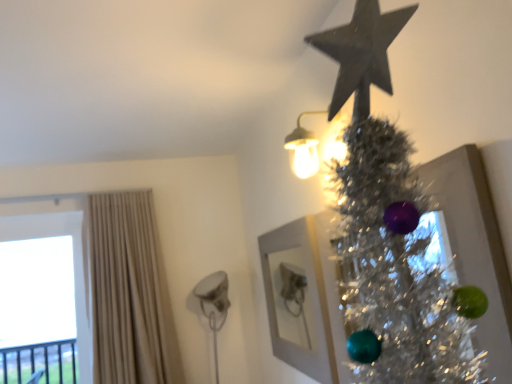
Where is `matte white sconce at upper right`? This screenshot has width=512, height=384. matte white sconce at upper right is located at coordinates (304, 148).

What do you see at coordinates (74, 265) in the screenshot? The width and height of the screenshot is (512, 384). I see `transparent glass window at left` at bounding box center [74, 265].

The height and width of the screenshot is (384, 512). I want to click on white matte picture frame at upper center, so click(x=304, y=299).

Can you confirm if white matte picture frame at upper center is positioned to the left of beige fabric curtain at left?

No.

Can you tell me how much white matte picture frame at upper center and beige fabric curtain at left differ in facing direction?

white matte picture frame at upper center and beige fabric curtain at left are facing 89.1 degrees away from each other.

From the picture: From the image's perspective, which is below, white matte picture frame at upper center or beige fabric curtain at left?

beige fabric curtain at left.

Between white matte picture frame at upper center and shiny silver tinsel at upper right, which one is positioned in front?

shiny silver tinsel at upper right.

Is point (320, 378) closer to viewer compared to point (429, 310)?

No, (320, 378) is behind (429, 310).

From the image's perspective, who appears lower, white matte picture frame at upper center or shiny silver tinsel at upper right?

From the image's view, white matte picture frame at upper center is below.

Considering the sizes of objects white matte picture frame at upper center and shiny silver tinsel at upper right in the image provided, who is thinner, white matte picture frame at upper center or shiny silver tinsel at upper right?

Thinner between the two is white matte picture frame at upper center.

Which of these two, shiny silver tinsel at upper right or beige fabric curtain at left, stands shorter?

With less height is shiny silver tinsel at upper right.

Which is in front, point (417, 218) or point (140, 286)?

The point (417, 218) is closer.

From a real-world perspective, which object rests below the other?

shiny silver tinsel at upper right is physically lower.

Identify the location of curtain below the matte white sconce at upper right (from the image's perspective). (130, 293).

In the image, is beige fabric curtain at left on the left side or the right side of matte white sconce at upper right?

In the image, beige fabric curtain at left appears on the left side of matte white sconce at upper right.

Does point (108, 362) come farther from viewer compared to point (301, 177)?

That is True.

From the picture: From the image's perspective, is beige fabric curtain at left positioned above or below matte white sconce at upper right?

From the image's perspective, beige fabric curtain at left appears below matte white sconce at upper right.

Between matte white sconce at upper right and beige fabric curtain at left, which one has more height?

With more height is beige fabric curtain at left.

Is matte white sconce at upper right not close to beige fabric curtain at left?

Yes.

Can we say matte white sconce at upper right lies outside beige fabric curtain at left?

Yes, matte white sconce at upper right is located beyond the bounds of beige fabric curtain at left.

From the picture: Measure the distance between matte white sconce at upper right and beige fabric curtain at left.

matte white sconce at upper right and beige fabric curtain at left are 5.63 feet apart from each other.

Could you tell me if beige fabric curtain at left is turned towards shiny silver tinsel at upper right?

No, beige fabric curtain at left does not turn towards shiny silver tinsel at upper right.

Looking at this image, considering the sizes of beige fabric curtain at left and shiny silver tinsel at upper right in the image, is beige fabric curtain at left wider or thinner than shiny silver tinsel at upper right?

In the image, beige fabric curtain at left appears to be wider than shiny silver tinsel at upper right.

Who is bigger, beige fabric curtain at left or shiny silver tinsel at upper right?

With larger size is beige fabric curtain at left.

From the image's perspective, between beige fabric curtain at left and shiny silver tinsel at upper right, which one is located above?

shiny silver tinsel at upper right.

Is transparent glass window at left taller than shiny silver tinsel at upper right?

Yes.

Where is `window lying below the shiny silver tinsel at upper right (from the image's perspective)`? window lying below the shiny silver tinsel at upper right (from the image's perspective) is located at coordinates (74, 265).

Between transparent glass window at left and shiny silver tinsel at upper right, which one has smaller size?

Smaller between the two is shiny silver tinsel at upper right.

The image size is (512, 384). In order to click on curtain below the white matte picture frame at upper center (from the image's perspective) in this screenshot , I will do `click(130, 293)`.

At what (x,y) coordinates should I click in order to perform the action: click on picture frame located behind the shiny silver tinsel at upper right. Please return your answer as a coordinate pair (x, y). The image size is (512, 384). Looking at the image, I should click on (304, 299).

Estimate the real-world distances between objects in this image. Which object is further from shiny silver tinsel at upper right, white matte picture frame at upper center or matte white sconce at upper right?

The object further to shiny silver tinsel at upper right is white matte picture frame at upper center.

Which object lies nearer to the anchor point beige fabric curtain at left, matte white sconce at upper right or shiny silver tinsel at upper right?

The object closer to beige fabric curtain at left is matte white sconce at upper right.

From the image, which object appears to be nearer to matte white sconce at upper right, white matte picture frame at upper center or beige fabric curtain at left?

white matte picture frame at upper center lies closer to matte white sconce at upper right than the other object.

Based on their spatial positions, is shiny silver tinsel at upper right or white matte picture frame at upper center closer to beige fabric curtain at left?

The object closer to beige fabric curtain at left is white matte picture frame at upper center.

Which object lies further to the anchor point beige fabric curtain at left, matte white sconce at upper right or white matte picture frame at upper center?

Based on the image, matte white sconce at upper right appears to be further to beige fabric curtain at left.

Which object lies nearer to the anchor point shiny silver tinsel at upper right, matte white sconce at upper right or white matte picture frame at upper center?

The object closer to shiny silver tinsel at upper right is matte white sconce at upper right.

Considering their positions, is transparent glass window at left positioned further to beige fabric curtain at left than matte white sconce at upper right?

matte white sconce at upper right is further to beige fabric curtain at left.

Which object lies further to the anchor point matte white sconce at upper right, transparent glass window at left or shiny silver tinsel at upper right?

transparent glass window at left is further to matte white sconce at upper right.

Image resolution: width=512 pixels, height=384 pixels. What are the coordinates of `light fixture between shiny silver tinsel at upper right and white matte picture frame at upper center along the z-axis` in the screenshot? It's located at (304, 148).

Identify the location of picture frame between transparent glass window at left and matte white sconce at upper right from left to right. (304, 299).

This screenshot has width=512, height=384. What are the coordinates of `light fixture positioned between shiny silver tinsel at upper right and beige fabric curtain at left from near to far` in the screenshot? It's located at (304, 148).

You are a GUI agent. You are given a task and a screenshot of the screen. Output one action in this format:
    pyautogui.click(x=<x>, y=<y>)
    Task: Click on the curtain located between transparent glass window at left and white matte picture frame at upper center in the left-right direction
    This screenshot has height=384, width=512.
    Given the screenshot: What is the action you would take?
    pyautogui.click(x=130, y=293)